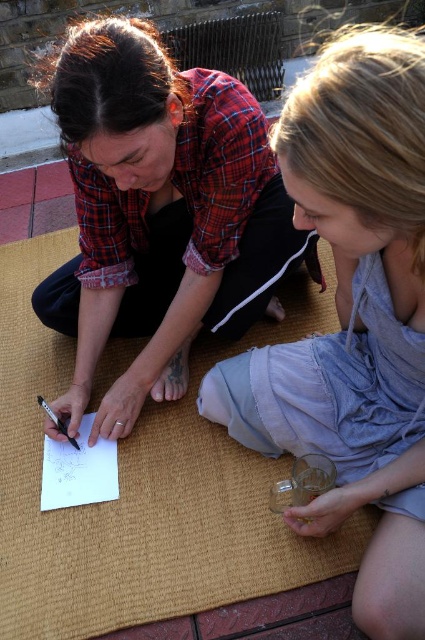
Is gray cotton dress at lower right thinner than matte plaid shirt at center?

Yes.

Does gray cotton dress at lower right appear on the right side of matte plaid shirt at center?

Correct, you'll find gray cotton dress at lower right to the right of matte plaid shirt at center.

The image size is (425, 640). What do you see at coordinates (353, 316) in the screenshot?
I see `gray cotton dress at lower right` at bounding box center [353, 316].

Locate an element on the screen. The height and width of the screenshot is (640, 425). gray cotton dress at lower right is located at coordinates (353, 316).

Does matte plaid shirt at center have a larger size compared to brown woven mat at center?

Incorrect, matte plaid shirt at center is not larger than brown woven mat at center.

Who is positioned more to the right, matte plaid shirt at center or brown woven mat at center?

brown woven mat at center is more to the right.

Image resolution: width=425 pixels, height=640 pixels. Identify the location of matte plaid shirt at center. (158, 212).

This screenshot has height=640, width=425. Identify the location of matte plaid shirt at center. (158, 212).

Does brown woven mat at center have a lesser width compared to white paper at center?

No.

The width and height of the screenshot is (425, 640). What do you see at coordinates (142, 486) in the screenshot? I see `brown woven mat at center` at bounding box center [142, 486].

Which is behind, point (11, 323) or point (93, 483)?

The point (11, 323) is behind.

Identify the location of brown woven mat at center. (142, 486).